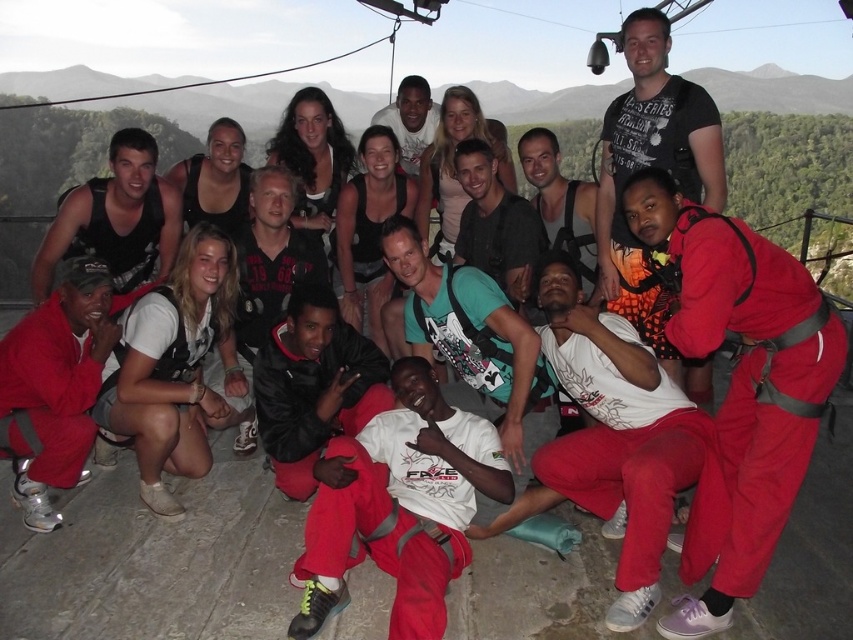
Question: Estimate the real-world distances between objects in this image. Which object is farther from the matte black t-shirt at upper right?

Choices:
 (A) white matte t-shirt at lower center
 (B) white matte t-shirt at center

Answer: (A)

Question: Which of the following is the farthest from the observer?

Choices:
 (A) matte black t-shirt at upper right
 (B) white matte t-shirt at center

Answer: (A)

Question: Based on their relative distances, which object is farther from the matte black t-shirt at upper right?

Choices:
 (A) white matte t-shirt at lower center
 (B) white matte t-shirt at center

Answer: (A)

Question: From the image, what is the correct spatial relationship of white matte t-shirt at center in relation to white matte t-shirt at lower center?

Choices:
 (A) below
 (B) above

Answer: (A)

Question: From the image, what is the correct spatial relationship of white matte t-shirt at center in relation to matte black t-shirt at upper right?

Choices:
 (A) left
 (B) right

Answer: (A)

Question: Is white matte t-shirt at lower center thinner than matte black t-shirt at upper right?

Choices:
 (A) no
 (B) yes

Answer: (A)